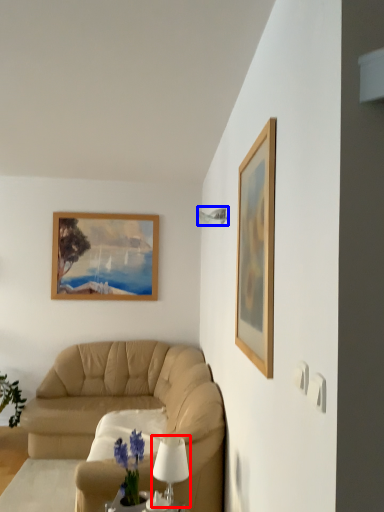
Question: Which point is further to the camera, table lamp (highlighted by a red box) or lamp (highlighted by a blue box)?

Choices:
 (A) table lamp
 (B) lamp

Answer: (B)